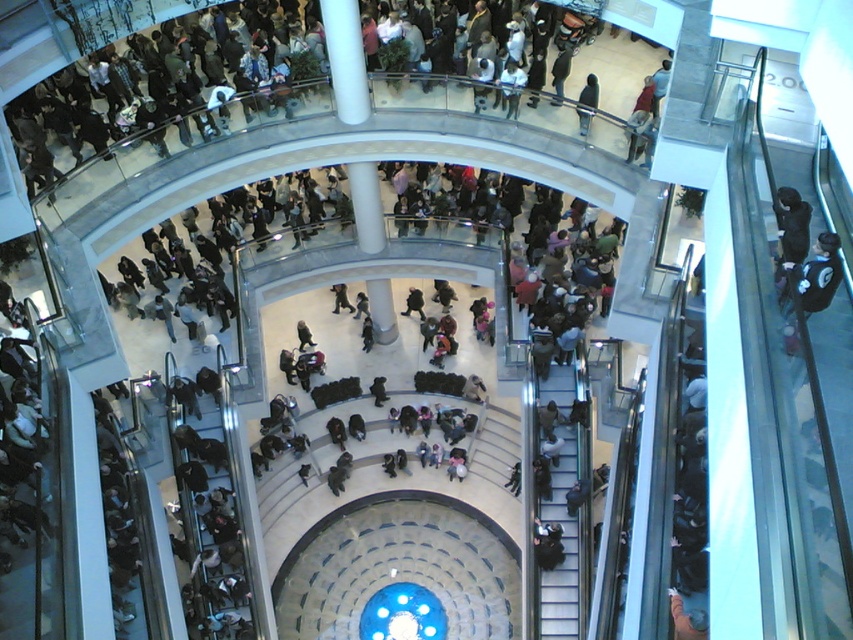
Question: Is metallic gray escalator at lower right bigger than dark blue jacket at center?

Choices:
 (A) no
 (B) yes

Answer: (A)

Question: Which point is farther to the camera?

Choices:
 (A) (556, 378)
 (B) (596, 77)
 (C) (447, 560)

Answer: (C)

Question: Which of the following is the farthest from the observer?

Choices:
 (A) translucent glass dome at center
 (B) metallic gray escalator at lower right

Answer: (A)

Question: Is translucent glass dome at center smaller than metallic gray escalator at lower right?

Choices:
 (A) no
 (B) yes

Answer: (B)

Question: Which of these objects is positioned farthest from the metallic gray escalator at lower right?

Choices:
 (A) dark blue jacket at center
 (B) translucent glass dome at center

Answer: (A)

Question: In this image, where is translucent glass dome at center located relative to dark blue jacket at center?

Choices:
 (A) left
 (B) right

Answer: (A)